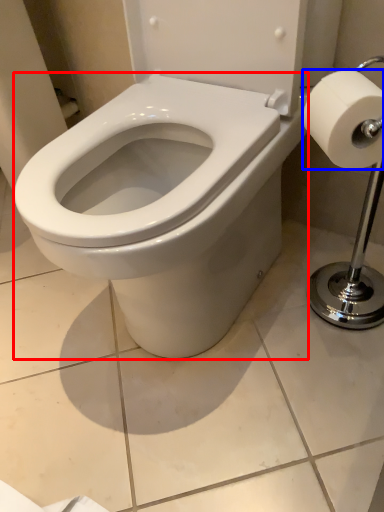
Question: Which object appears closest to the camera in this image, bidet (highlighted by a red box) or toilet paper (highlighted by a blue box)?

Choices:
 (A) bidet
 (B) toilet paper

Answer: (A)